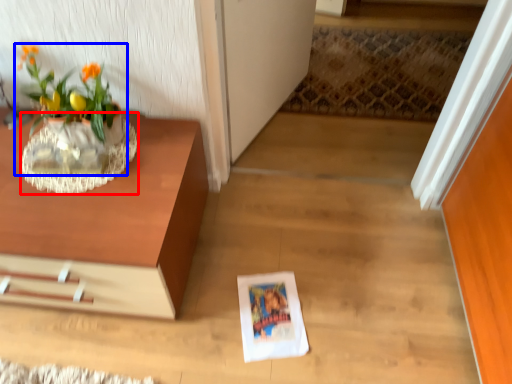
Question: Which object appears farthest to the camera in this image, vase (highlighted by a red box) or houseplant (highlighted by a blue box)?

Choices:
 (A) vase
 (B) houseplant

Answer: (A)